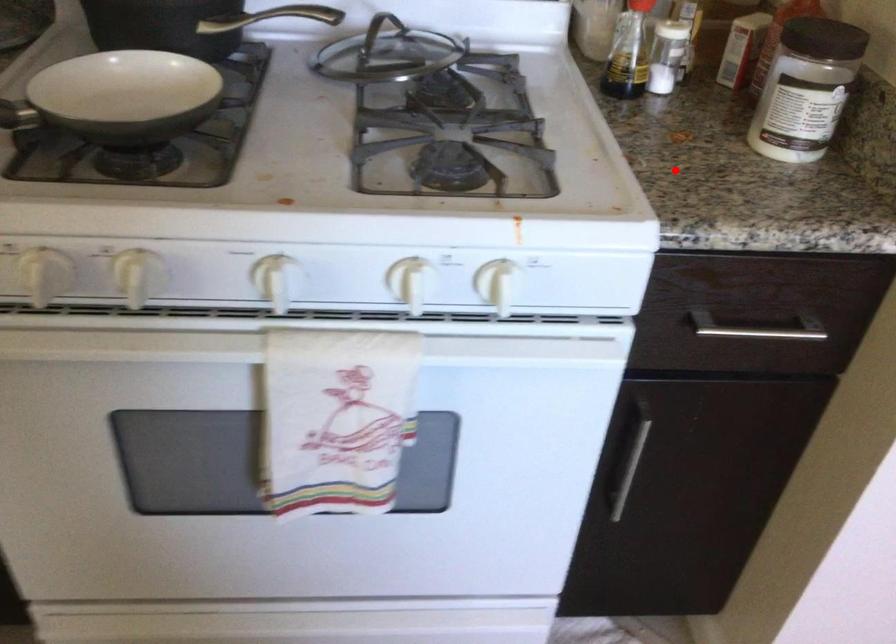
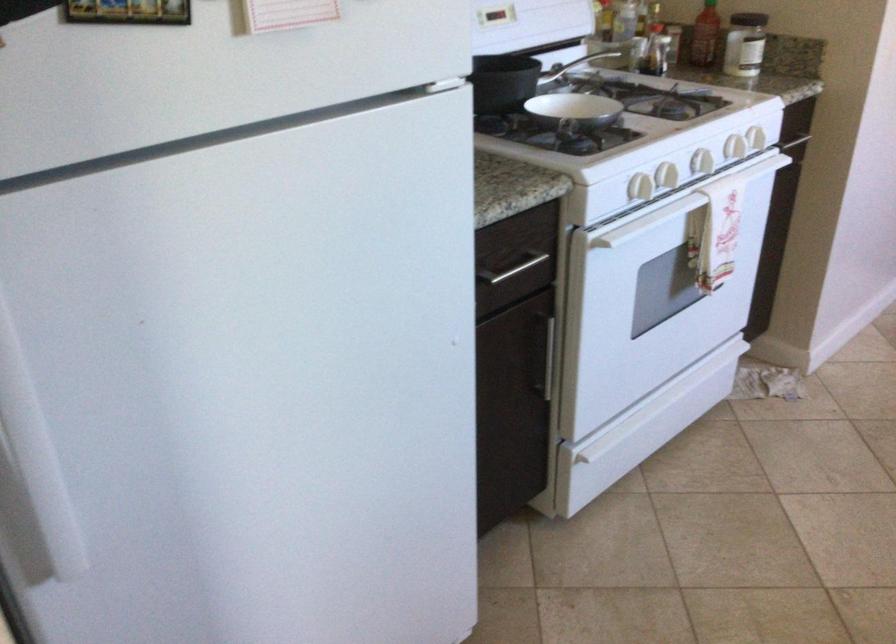
Where in the second image is the point corresponding to the highlighted location from the first image?

(745, 44)